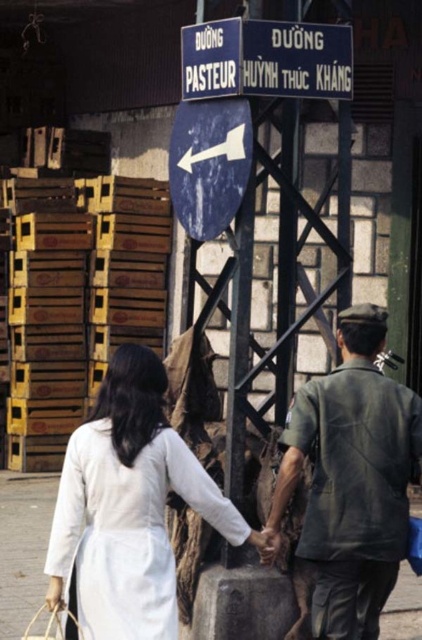
Is white cotton ao dai at center above dark green uniform at center?

Actually, white cotton ao dai at center is below dark green uniform at center.

Who is positioned more to the right, white cotton ao dai at center or dark green uniform at center?

dark green uniform at center is more to the right.

Is point (67, 561) farther from viewer compared to point (402, 440)?

No, (67, 561) is in front of (402, 440).

You are a GUI agent. You are given a task and a screenshot of the screen. Output one action in this format:
    pyautogui.click(x=<x>, y=<y>)
    Task: Click on the white cotton ao dai at center
    The width and height of the screenshot is (422, 640).
    Given the screenshot: What is the action you would take?
    pyautogui.click(x=129, y=506)

Does white cotton ao dai at center appear under blue matte sign at center?

Correct, white cotton ao dai at center is located below blue matte sign at center.

Is white cotton ao dai at center positioned before blue matte sign at center?

Yes, white cotton ao dai at center is in front of blue matte sign at center.

I want to click on white cotton ao dai at center, so click(x=129, y=506).

Where is `white cotton ao dai at center`? This screenshot has width=422, height=640. white cotton ao dai at center is located at coordinates (129, 506).

Is white cotton ao dai at center above blue painted metal sign at upper center?

Incorrect, white cotton ao dai at center is not positioned above blue painted metal sign at upper center.

Who is positioned more to the right, white cotton ao dai at center or blue painted metal sign at upper center?

Positioned to the right is blue painted metal sign at upper center.

Is point (97, 500) positioned in front of point (208, 84)?

That is True.

Where is `white cotton ao dai at center`? The width and height of the screenshot is (422, 640). white cotton ao dai at center is located at coordinates [129, 506].